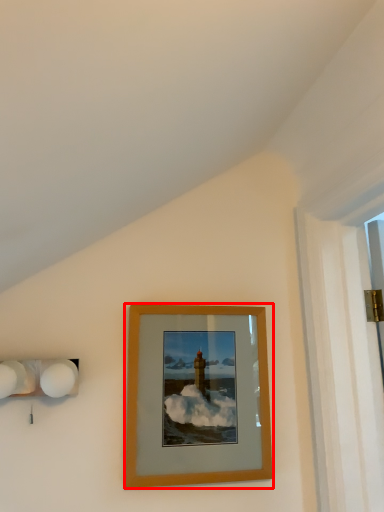
Question: Observing the image, what is the correct spatial positioning of picture frame (annotated by the red box) in reference to lamp?

Choices:
 (A) right
 (B) left

Answer: (A)